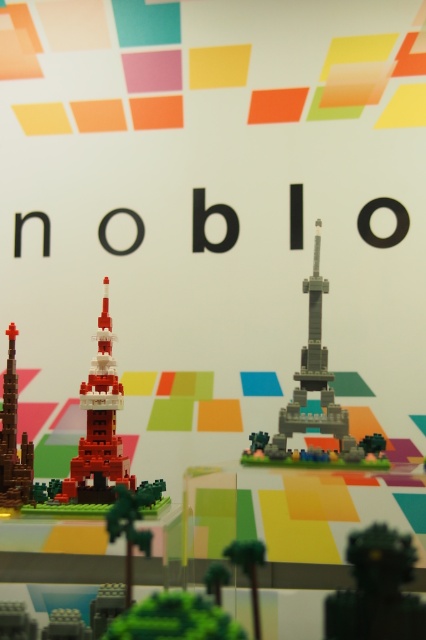
Which is in front, point (405, 620) or point (5, 465)?

Point (405, 620) is more forward.

Who is lower down, green matte statue at lower right or brick-like tower at left?

Positioned lower is green matte statue at lower right.

Find the location of a particular element. The height and width of the screenshot is (640, 426). green matte statue at lower right is located at coordinates (377, 589).

Can you confirm if brick-like tower at center is positioned to the right of brick-like tower at left?

Correct, you'll find brick-like tower at center to the right of brick-like tower at left.

Where is `brick-like tower at center`? This screenshot has width=426, height=640. brick-like tower at center is located at coordinates (98, 428).

Is the position of green matte statue at lower right less distant than that of gray metallic eiffel tower at center?

Yes, it is in front of gray metallic eiffel tower at center.

Is green matte statue at lower right to the right of gray metallic eiffel tower at center from the viewer's perspective?

Indeed, green matte statue at lower right is positioned on the right side of gray metallic eiffel tower at center.

What are the coordinates of `green matte statue at lower right` in the screenshot? It's located at (377, 589).

Image resolution: width=426 pixels, height=640 pixels. Identify the location of green matte statue at lower right. (377, 589).